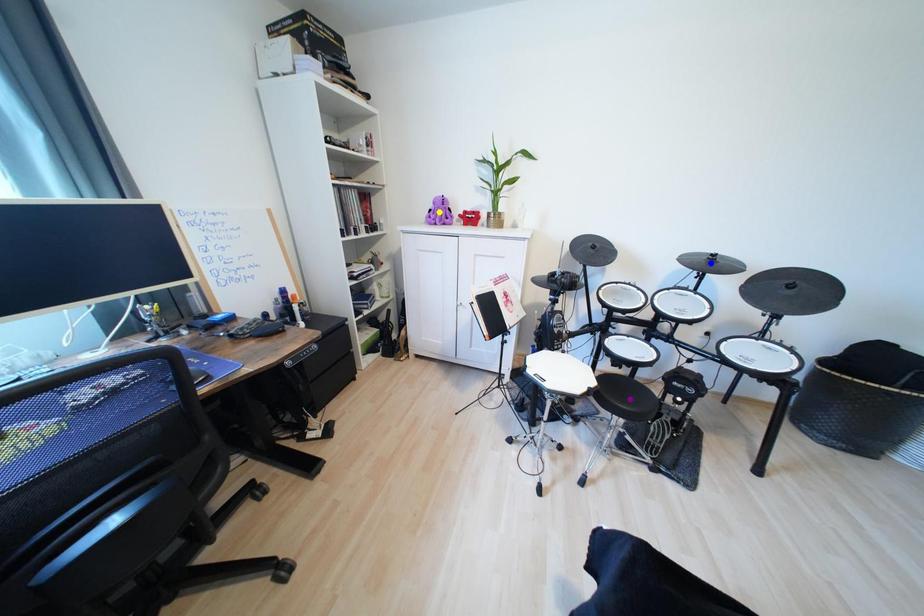
Order these from nearest to farthest:
yellow point
purple point
blue point

purple point, blue point, yellow point